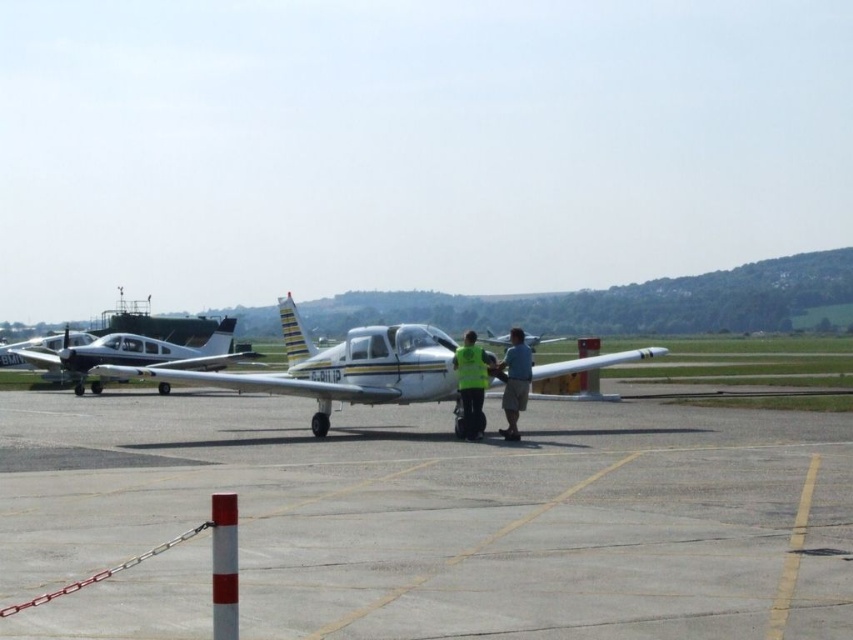
Between high visibility yellow jacket at center and blue fabric shirt at center, which one is positioned higher?

high visibility yellow jacket at center is above.

Is point (456, 365) farther from viewer compared to point (497, 364)?

No, it is not.

The image size is (853, 640). Find the location of `high visibility yellow jacket at center`. high visibility yellow jacket at center is located at coordinates (471, 385).

Looking at this image, is smooth asphalt tarmac at center shorter than white glossy airplane at center?

Yes.

Based on the photo, measure the distance between point (635, 476) and camera.

Point (635, 476) is 36.94 feet from camera.

This screenshot has width=853, height=640. Find the location of `smooth asphalt tarmac at center`. smooth asphalt tarmac at center is located at coordinates (450, 515).

Is white glossy airplane at center closer to the viewer compared to blue fabric shirt at center?

Yes, it is.

Is point (575, 362) farther from viewer compared to point (521, 346)?

Yes, it is.

You are a GUI agent. You are given a task and a screenshot of the screen. Output one action in this format:
    pyautogui.click(x=<x>, y=<y>)
    Task: Click on the white glossy airplane at center
    This screenshot has width=853, height=640.
    Given the screenshot: What is the action you would take?
    (338, 368)